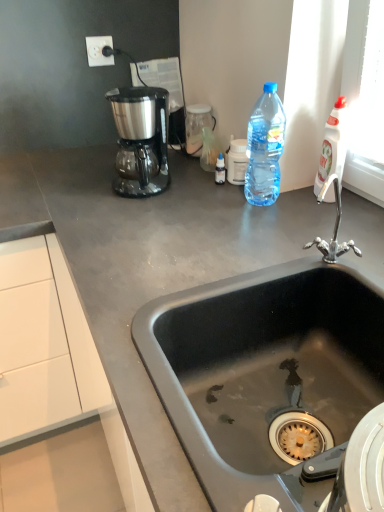
Question: Is black matte sink at center at the back of gray matte countertop at center?

Choices:
 (A) no
 (B) yes

Answer: (A)

Question: Can you confirm if gray matte countertop at center is smaller than black matte sink at center?

Choices:
 (A) no
 (B) yes

Answer: (A)

Question: From the image's perspective, is gray matte countertop at center on top of black matte sink at center?

Choices:
 (A) yes
 (B) no

Answer: (A)

Question: Considering the relative positions of gray matte countertop at center and black matte sink at center in the image provided, is gray matte countertop at center behind black matte sink at center?

Choices:
 (A) no
 (B) yes

Answer: (B)

Question: From a real-world perspective, is gray matte countertop at center over black matte sink at center?

Choices:
 (A) yes
 (B) no

Answer: (B)

Question: Does gray matte countertop at center have a lesser height compared to black matte sink at center?

Choices:
 (A) yes
 (B) no

Answer: (B)

Question: Considering the relative positions of gray matte countertop at center and satin black coffee maker at upper left in the image provided, is gray matte countertop at center to the right of satin black coffee maker at upper left from the viewer's perspective?

Choices:
 (A) no
 (B) yes

Answer: (A)

Question: Is gray matte countertop at center outside satin black coffee maker at upper left?

Choices:
 (A) yes
 (B) no

Answer: (A)

Question: Is gray matte countertop at center to the left of satin black coffee maker at upper left from the viewer's perspective?

Choices:
 (A) no
 (B) yes

Answer: (B)

Question: From a real-world perspective, is gray matte countertop at center below satin black coffee maker at upper left?

Choices:
 (A) yes
 (B) no

Answer: (A)

Question: Is satin black coffee maker at upper left at the back of gray matte countertop at center?

Choices:
 (A) no
 (B) yes

Answer: (A)

Question: Considering the relative sizes of gray matte countertop at center and satin black coffee maker at upper left in the image provided, is gray matte countertop at center bigger than satin black coffee maker at upper left?

Choices:
 (A) no
 (B) yes

Answer: (B)

Question: Would you say white plastic electric outlet at upper left is outside gray matte countertop at center?

Choices:
 (A) yes
 (B) no

Answer: (A)